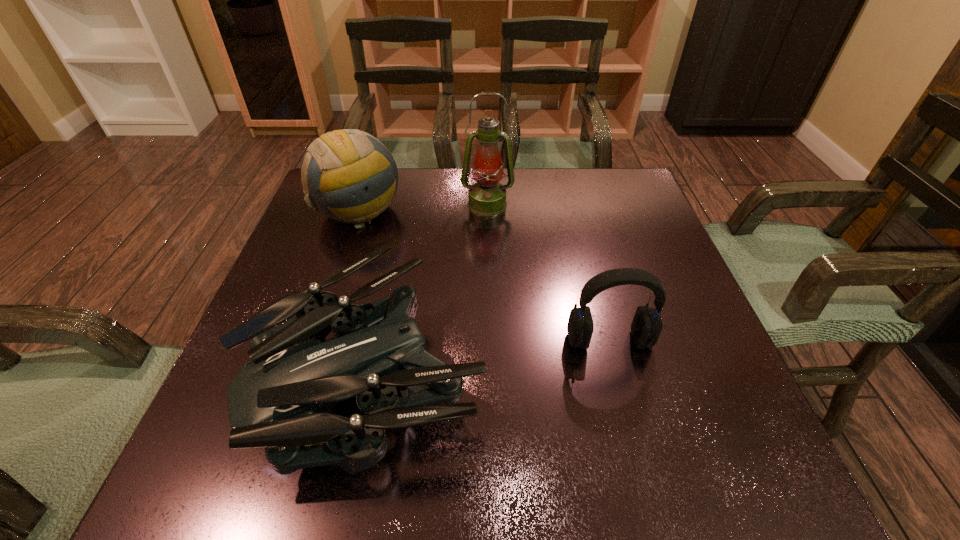
Locate an element on the screen. The height and width of the screenshot is (540, 960). the tallest object is located at coordinates (487, 197).

Identify the location of volleyball. [x=348, y=175].

This screenshot has width=960, height=540. I want to click on the third tallest object, so click(646, 327).

Identify the location of the rightmost object. (x=646, y=327).

Locate an element on the screen. This screenshot has height=540, width=960. the shortest object is located at coordinates (282, 399).

Identify the location of vacant region located on the left of the tallest object. (345, 204).

Where is `free space located on the front of the second tallest object`? The height and width of the screenshot is (540, 960). free space located on the front of the second tallest object is located at coordinates (339, 265).

Where is `free point located on the headband of the rightmost object`? The height and width of the screenshot is (540, 960). free point located on the headband of the rightmost object is located at coordinates (636, 444).

At what (x,y) coordinates should I click in order to perform the action: click on free spot located on the back of the drone. Please return your answer as a coordinate pair (x, y). This screenshot has width=960, height=540. Looking at the image, I should click on (406, 199).

This screenshot has height=540, width=960. What are the coordinates of `oil lamp present at the far edge` in the screenshot? It's located at tap(487, 197).